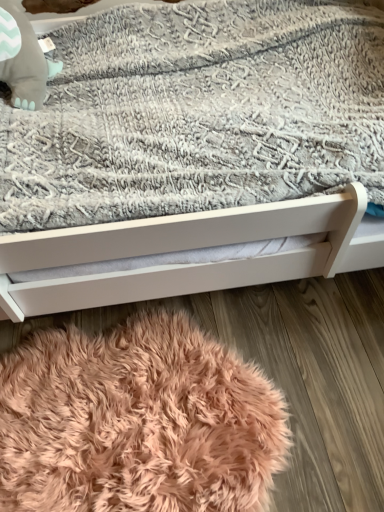
At what (x,y) coordinates should I click in order to perform the action: click on vacant area to the right of peachy soft rug at lower center. Please return your answer as a coordinate pair (x, y). Looking at the image, I should click on (318, 370).